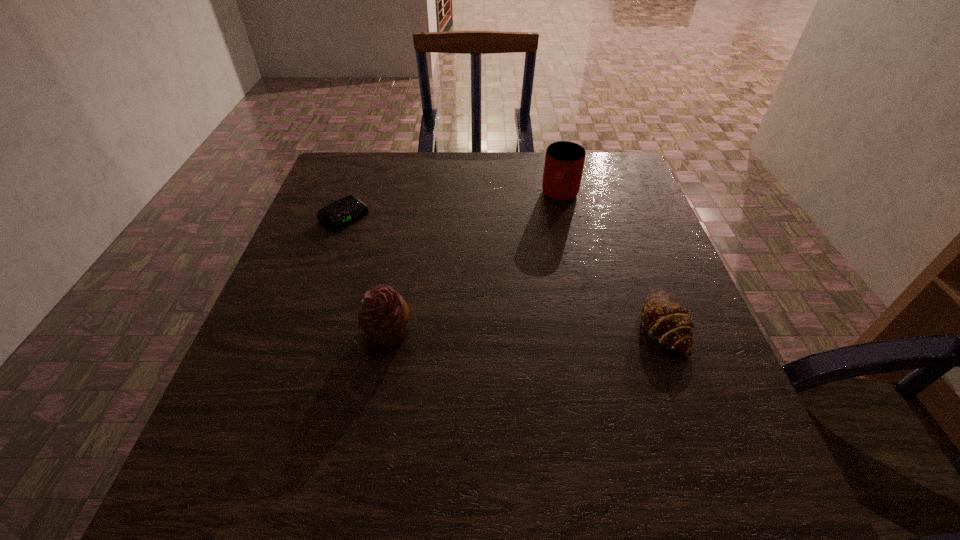
Locate an element on the screen. The width and height of the screenshot is (960, 540). vacant space on the desktop that is between the third object from right to left and the crescent roll and is positioned on the handle side of the third object from left to right is located at coordinates (513, 328).

Where is `vacant space on the desktop that is between the third object from right to left and the crescent roll and is positioned on the display of the leftmost object`? This screenshot has width=960, height=540. vacant space on the desktop that is between the third object from right to left and the crescent roll and is positioned on the display of the leftmost object is located at coordinates [497, 328].